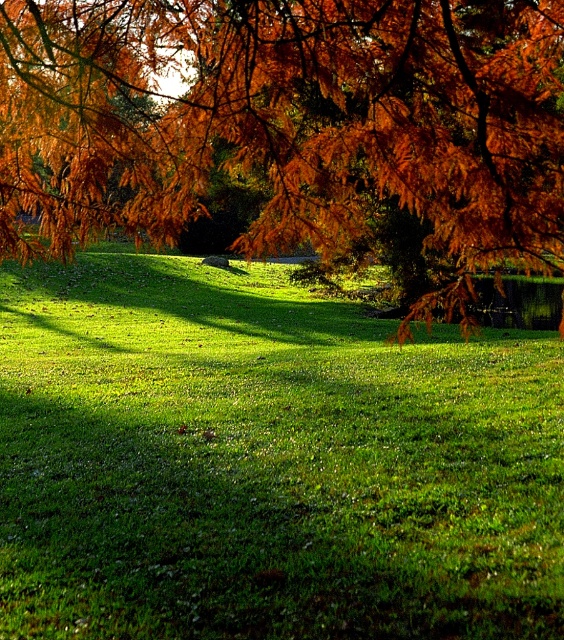
Which is behind, point (285, 582) or point (350, 44)?

The point (285, 582) is behind.

Which is more to the left, green grassy at center or orange leafy branch at upper center?

Positioned to the left is orange leafy branch at upper center.

Is point (429, 577) behind point (393, 20)?

Yes, point (429, 577) is farther from viewer.

Where is `green grassy at center`? The width and height of the screenshot is (564, 640). green grassy at center is located at coordinates (266, 461).